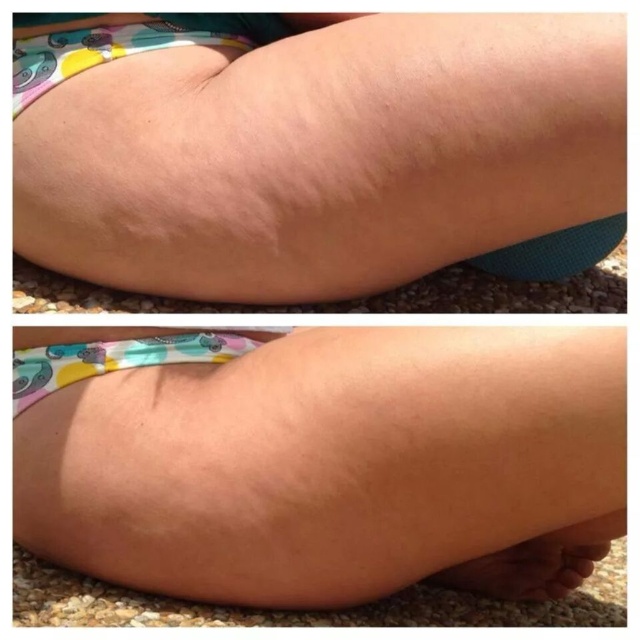
Describe the element at coordinates (336, 465) in the screenshot. I see `smooth skin at lower center` at that location.

Is smooth skin at lower center in front of matte floral diaper at center?

Yes, smooth skin at lower center is closer to the viewer.

Locate an element on the screen. This screenshot has width=640, height=640. smooth skin at lower center is located at coordinates (336, 465).

Does smooth skin at lower center have a larger size compared to brown matte toe at lower right?

Correct, smooth skin at lower center is larger in size than brown matte toe at lower right.

Find the location of a particular element. The image size is (640, 640). smooth skin at lower center is located at coordinates (336, 465).

I want to click on smooth skin at lower center, so click(x=336, y=465).

Does smooth skin at center have a larger size compared to smooth skin at lower center?

Yes, smooth skin at center is bigger than smooth skin at lower center.

What do you see at coordinates (316, 148) in the screenshot?
I see `smooth skin at center` at bounding box center [316, 148].

This screenshot has height=640, width=640. Find the location of `smooth skin at center`. smooth skin at center is located at coordinates (316, 148).